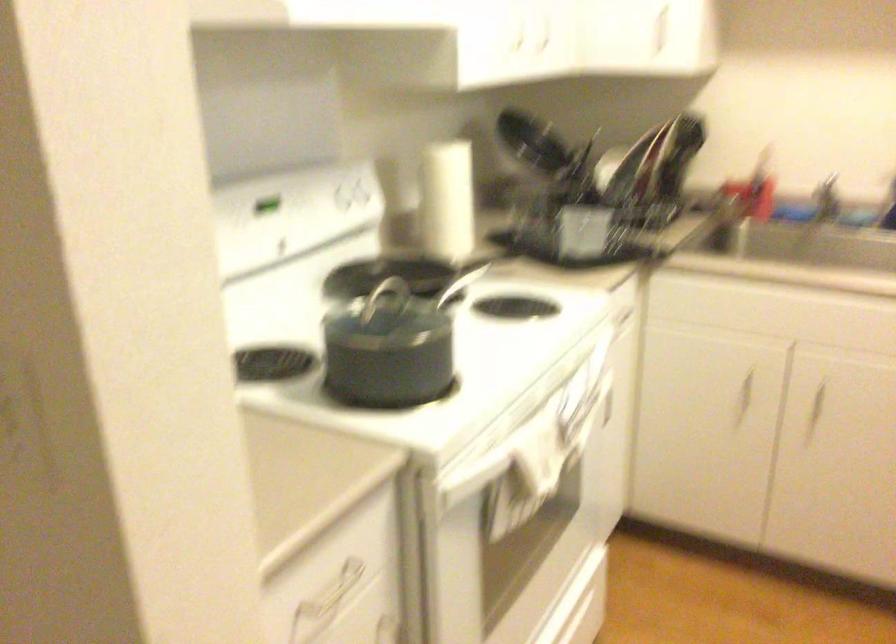
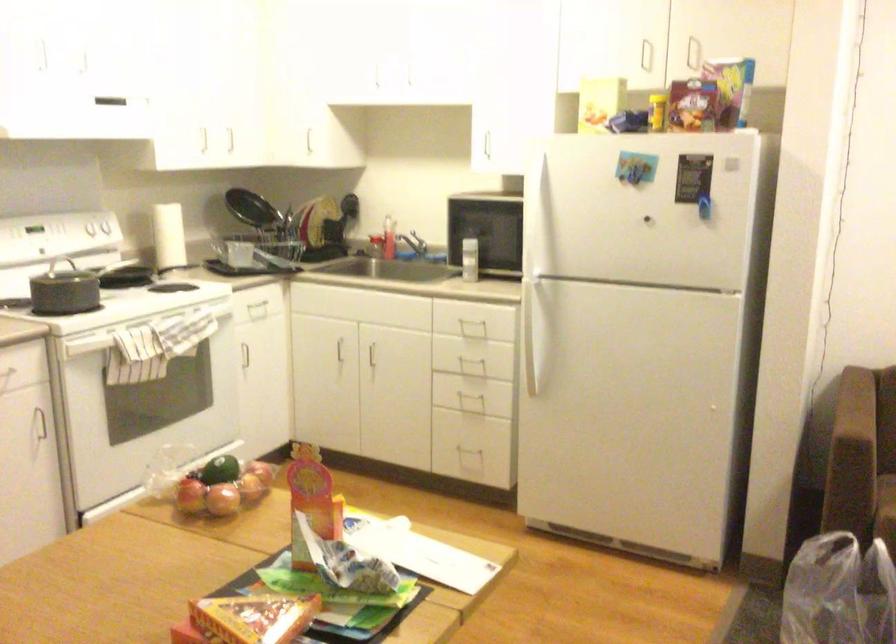
Where in the second image is the point corresponding to (x=321, y=190) from the first image?

(98, 232)